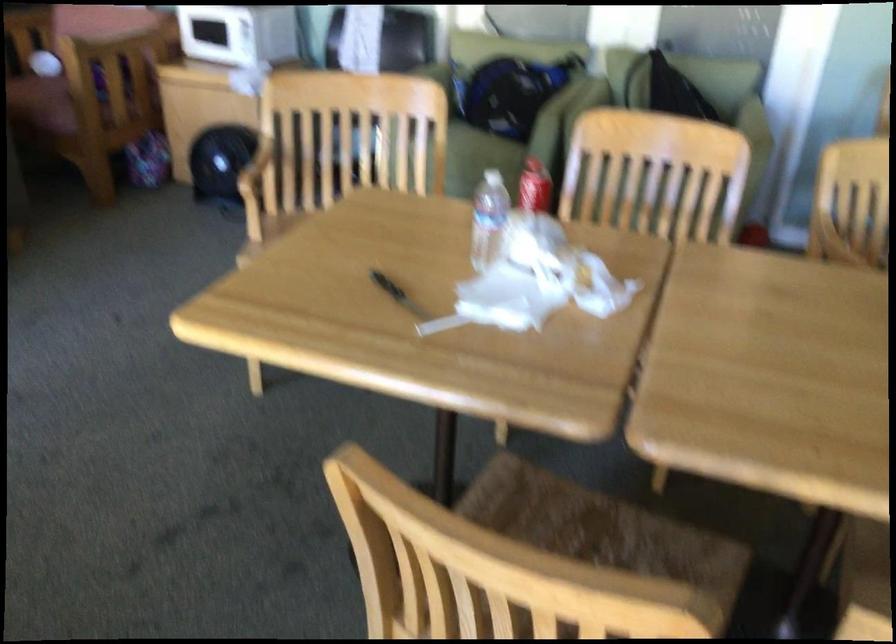
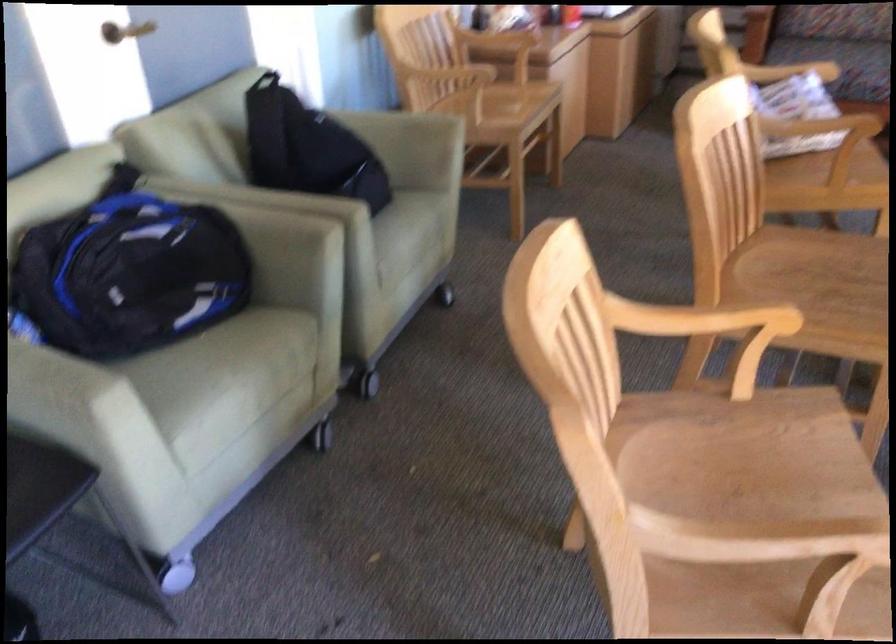
Where in the second image is the point corresponding to (x=576, y=93) from the first image?

(250, 194)